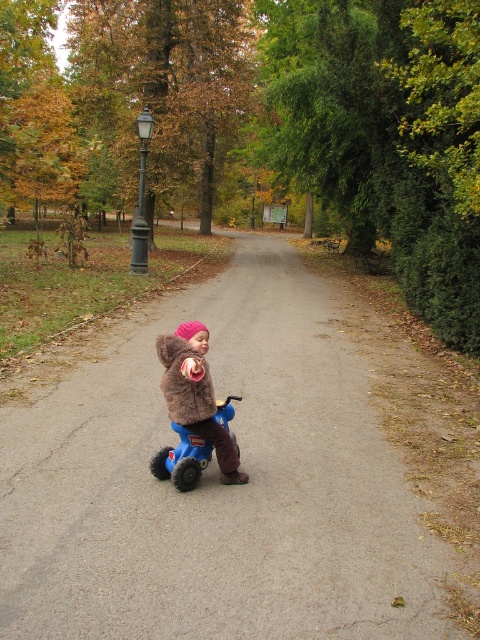
You are a parent trying to decide whether to place a small backpack between the fuzzy brown jacket at center and the blue rubber toy car at center. Based on their widths, which object should the backpack be placed closer to to ensure it fits?

The fuzzy brown jacket at center has a lesser width compared to blue rubber toy car at center, so the backpack should be placed closer to the fuzzy brown jacket at center to ensure it fits.

You are a parent looking for your child in the park. You see the fuzzy brown jacket at center and the blue rubber toy car at center. Which object is closer to the right side of the path?

The fuzzy brown jacket at center is closer to the right side of the path because it is positioned to the right of the blue rubber toy car at center.